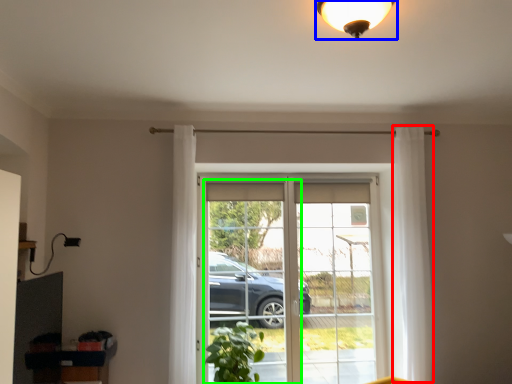
Question: Considering the real-world distances, which object is closest to curtain (highlighted by a red box)? lamp (highlighted by a blue box) or screen door (highlighted by a green box).

Choices:
 (A) lamp
 (B) screen door

Answer: (A)